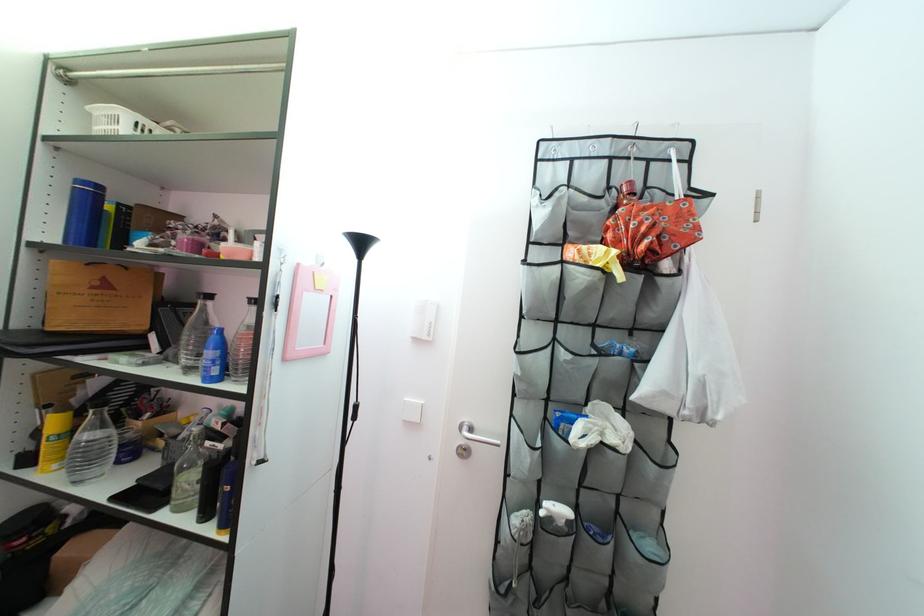
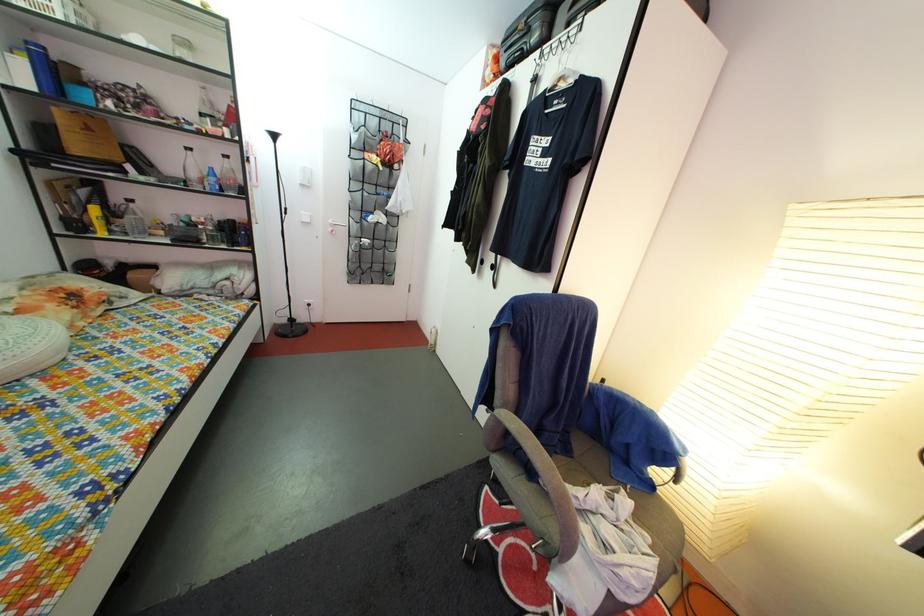
In the second image, find the point that corresponds to the point at 232,354 in the first image.

(225, 185)